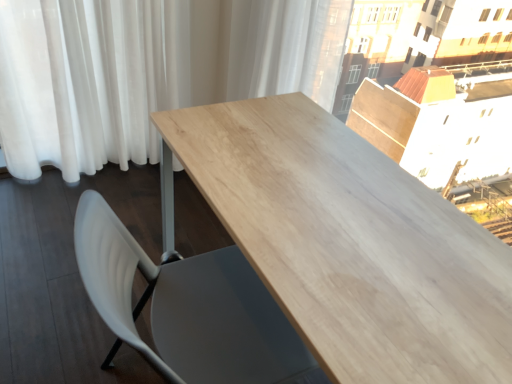
This screenshot has height=384, width=512. Describe the element at coordinates (347, 242) in the screenshot. I see `light wood table at center` at that location.

Where is `white sheer curtain at left, which is counted as the 2th curtain, starting from the right`? white sheer curtain at left, which is counted as the 2th curtain, starting from the right is located at coordinates (148, 70).

Describe the element at coordinates (189, 308) in the screenshot. I see `white plastic chair at lower left` at that location.

The height and width of the screenshot is (384, 512). In order to click on white sheer curtain at upper center, positioned as the 2th curtain in left-to-right order in this screenshot , I will do `click(287, 48)`.

Based on the photo, from a real-world perspective, between light wood table at center and white sheer curtain at upper center, positioned as the 2th curtain in left-to-right order, who is vertically lower?

light wood table at center.

Where is `the 2nd curtain above the light wood table at center (from the image's perspective)`? The width and height of the screenshot is (512, 384). the 2nd curtain above the light wood table at center (from the image's perspective) is located at coordinates (287, 48).

Considering the sizes of objects light wood table at center and white sheer curtain at upper center, positioned as the 2th curtain in left-to-right order, in the image provided, who is smaller, light wood table at center or white sheer curtain at upper center, positioned as the 2th curtain in left-to-right order,?

white sheer curtain at upper center, positioned as the 2th curtain in left-to-right order, is smaller.

From the image's perspective, is light wood table at center located above white sheer curtain at upper center, positioned as the 2th curtain in left-to-right order?

Actually, light wood table at center appears below white sheer curtain at upper center, positioned as the 2th curtain in left-to-right order, in the image.

From a real-world perspective, which is physically below, light wood table at center or white sheer curtain at left, which is counted as the 2th curtain, starting from the right?

In real-world perspective, light wood table at center is lower.

Is white sheer curtain at left, arranged as the 1th curtain when viewed from the left, located within light wood table at center?

No, white sheer curtain at left, arranged as the 1th curtain when viewed from the left, is not surrounded by light wood table at center.

Is point (192, 141) closer or farther from the camera than point (20, 27)?

Point (192, 141) is positioned closer to the camera compared to point (20, 27).

Which of these two, light wood table at center or white sheer curtain at left, which is counted as the 2th curtain, starting from the right, is smaller?

white sheer curtain at left, which is counted as the 2th curtain, starting from the right.

Based on the photo, is white sheer curtain at upper center, positioned as the 2th curtain in left-to-right order, aimed at white plastic chair at lower left?

No, white sheer curtain at upper center, positioned as the 2th curtain in left-to-right order, does not turn towards white plastic chair at lower left.

At what (x,y) coordinates should I click in order to perform the action: click on the 2nd curtain above the white plastic chair at lower left (from the image's perspective). Please return your answer as a coordinate pair (x, y). Looking at the image, I should click on point(287,48).

How different are the orientations of white sheer curtain at upper center, arranged as the first curtain when viewed from the right, and white plastic chair at lower left in degrees?

white sheer curtain at upper center, arranged as the first curtain when viewed from the right, and white plastic chair at lower left are facing 0.597 degrees away from each other.

From the image's perspective, is white sheer curtain at upper center, arranged as the first curtain when viewed from the right, under white plastic chair at lower left?

Incorrect, from the image's perspective, white sheer curtain at upper center, arranged as the first curtain when viewed from the right, is higher than white plastic chair at lower left.

From the image's perspective, would you say white sheer curtain at upper center, arranged as the first curtain when viewed from the right, is shown under light wood table at center?

No, from the image's perspective, white sheer curtain at upper center, arranged as the first curtain when viewed from the right, is not below light wood table at center.

The height and width of the screenshot is (384, 512). Identify the location of curtain on the right of light wood table at center. (287, 48).

Is white sheer curtain at upper center, arranged as the first curtain when viewed from the right, not near light wood table at center?

white sheer curtain at upper center, arranged as the first curtain when viewed from the right, is near light wood table at center, not far away.

Choose the correct answer: Is white sheer curtain at upper center, arranged as the first curtain when viewed from the right, inside light wood table at center or outside it?

white sheer curtain at upper center, arranged as the first curtain when viewed from the right, is outside light wood table at center.

From the image's perspective, is white sheer curtain at left, arranged as the 1th curtain when viewed from the left, beneath white plastic chair at lower left?

No.

Considering the sizes of objects white sheer curtain at left, which is counted as the 2th curtain, starting from the right, and white plastic chair at lower left in the image provided, who is taller, white sheer curtain at left, which is counted as the 2th curtain, starting from the right, or white plastic chair at lower left?

white sheer curtain at left, which is counted as the 2th curtain, starting from the right, is taller.

Based on the photo, does white sheer curtain at left, which is counted as the 2th curtain, starting from the right, have a greater width compared to white plastic chair at lower left?

In fact, white sheer curtain at left, which is counted as the 2th curtain, starting from the right, might be narrower than white plastic chair at lower left.

From the image's perspective, which one is positioned higher, white sheer curtain at upper center, positioned as the 2th curtain in left-to-right order, or white sheer curtain at left, which is counted as the 2th curtain, starting from the right?

white sheer curtain at upper center, positioned as the 2th curtain in left-to-right order, appears higher in the image.

Is white sheer curtain at upper center, positioned as the 2th curtain in left-to-right order, facing away from white sheer curtain at left, which is counted as the 2th curtain, starting from the right?

No, white sheer curtain at upper center, positioned as the 2th curtain in left-to-right order,'s orientation is not away from white sheer curtain at left, which is counted as the 2th curtain, starting from the right.

Can you confirm if white sheer curtain at upper center, arranged as the first curtain when viewed from the right, is bigger than white sheer curtain at left, arranged as the 1th curtain when viewed from the left?

No, white sheer curtain at upper center, arranged as the first curtain when viewed from the right, is not bigger than white sheer curtain at left, arranged as the 1th curtain when viewed from the left.

Is white plastic chair at lower left positioned beyond the bounds of white sheer curtain at upper center, arranged as the first curtain when viewed from the right?

white plastic chair at lower left is positioned outside white sheer curtain at upper center, arranged as the first curtain when viewed from the right.

Between white plastic chair at lower left and white sheer curtain at upper center, arranged as the first curtain when viewed from the right, which one is positioned in front?

white plastic chair at lower left.

Between white plastic chair at lower left and white sheer curtain at upper center, positioned as the 2th curtain in left-to-right order, which one appears on the right side from the viewer's perspective?

white sheer curtain at upper center, positioned as the 2th curtain in left-to-right order.

From a real-world perspective, is white plastic chair at lower left above or below white sheer curtain at upper center, arranged as the first curtain when viewed from the right?

From a real-world perspective, white plastic chair at lower left is physically below white sheer curtain at upper center, arranged as the first curtain when viewed from the right.

From the image's perspective, which curtain is the 2nd one above the light wood table at center? Please provide its 2D coordinates.

[(287, 48)]

This screenshot has height=384, width=512. In order to click on table that appears below the white sheer curtain at left, which is counted as the 2th curtain, starting from the right (from a real-world perspective) in this screenshot , I will do `click(347, 242)`.

Estimate the real-world distances between objects in this image. Which object is further from white sheer curtain at upper center, arranged as the first curtain when viewed from the right, white plastic chair at lower left or light wood table at center?

Among the two, white plastic chair at lower left is located further to white sheer curtain at upper center, arranged as the first curtain when viewed from the right.

Based on their spatial positions, is white plastic chair at lower left or white sheer curtain at upper center, positioned as the 2th curtain in left-to-right order, further from light wood table at center?

The object further to light wood table at center is white sheer curtain at upper center, positioned as the 2th curtain in left-to-right order.

Based on their spatial positions, is light wood table at center or white sheer curtain at upper center, arranged as the first curtain when viewed from the right, further from white sheer curtain at left, which is counted as the 2th curtain, starting from the right?

light wood table at center is further to white sheer curtain at left, which is counted as the 2th curtain, starting from the right.

Considering their positions, is white sheer curtain at upper center, arranged as the first curtain when viewed from the right, positioned closer to white sheer curtain at left, which is counted as the 2th curtain, starting from the right, than white plastic chair at lower left?

white sheer curtain at upper center, arranged as the first curtain when viewed from the right.

From the image, which object appears to be nearer to white plastic chair at lower left, white sheer curtain at upper center, positioned as the 2th curtain in left-to-right order, or light wood table at center?

light wood table at center lies closer to white plastic chair at lower left than the other object.

Which object lies nearer to the anchor point white sheer curtain at left, which is counted as the 2th curtain, starting from the right, white sheer curtain at upper center, positioned as the 2th curtain in left-to-right order, or light wood table at center?

Based on the image, white sheer curtain at upper center, positioned as the 2th curtain in left-to-right order, appears to be nearer to white sheer curtain at left, which is counted as the 2th curtain, starting from the right.

In the scene shown: From the image, which object appears to be nearer to white sheer curtain at left, which is counted as the 2th curtain, starting from the right, white plastic chair at lower left or light wood table at center?

Among the two, light wood table at center is located nearer to white sheer curtain at left, which is counted as the 2th curtain, starting from the right.

When comparing their distances from white plastic chair at lower left, does light wood table at center or white sheer curtain at upper center, arranged as the first curtain when viewed from the right, seem closer?

light wood table at center.

Locate an element on the screen. chair between white sheer curtain at left, which is counted as the 2th curtain, starting from the right, and white sheer curtain at upper center, arranged as the first curtain when viewed from the right, in the horizontal direction is located at coordinates (189, 308).

Find the location of a particular element. The width and height of the screenshot is (512, 384). chair between white sheer curtain at upper center, arranged as the first curtain when viewed from the right, and light wood table at center in the up-down direction is located at coordinates (189, 308).

This screenshot has width=512, height=384. Identify the location of curtain between white sheer curtain at upper center, arranged as the first curtain when viewed from the right, and light wood table at center, in the vertical direction. (148, 70).

At what (x,y) coordinates should I click in order to perform the action: click on chair between white sheer curtain at left, arranged as the 1th curtain when viewed from the left, and light wood table at center in the up-down direction. Please return your answer as a coordinate pair (x, y). The width and height of the screenshot is (512, 384). Looking at the image, I should click on coord(189,308).